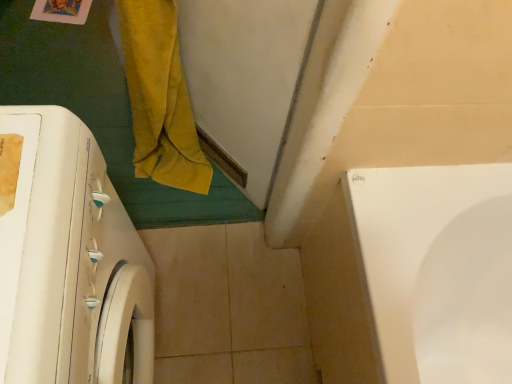
Identify the location of white glossy washing machine at left. (67, 258).

This screenshot has height=384, width=512. What do you see at coordinates (67, 258) in the screenshot?
I see `white glossy washing machine at left` at bounding box center [67, 258].

From the picture: Measure the distance between point (127, 8) and camera.

Point (127, 8) and camera are 32.80 inches apart.

Describe the element at coordinates (160, 97) in the screenshot. I see `yellow velvety bath towel at left` at that location.

Where is `yellow velvety bath towel at left`? yellow velvety bath towel at left is located at coordinates (160, 97).

This screenshot has width=512, height=384. Find the location of `white glossy washing machine at left`. white glossy washing machine at left is located at coordinates (67, 258).

Consider the image. Between yellow velvety bath towel at left and white glossy washing machine at left, which one appears on the left side from the viewer's perspective?

From the viewer's perspective, white glossy washing machine at left appears more on the left side.

Which object is closer to the camera, yellow velvety bath towel at left or white glossy washing machine at left?

white glossy washing machine at left is in front.

Considering the positions of points (129, 82) and (11, 219), is point (129, 82) closer to camera compared to point (11, 219)?

No, (129, 82) is behind (11, 219).

From the image's perspective, who appears lower, yellow velvety bath towel at left or white glossy washing machine at left?

white glossy washing machine at left is shown below in the image.

From a real-world perspective, between yellow velvety bath towel at left and white glossy washing machine at left, who is vertically lower?

yellow velvety bath towel at left is physically lower.

In terms of width, does yellow velvety bath towel at left look wider or thinner when compared to white glossy washing machine at left?

Considering their sizes, yellow velvety bath towel at left looks slimmer than white glossy washing machine at left.

Considering the sizes of objects yellow velvety bath towel at left and white glossy washing machine at left in the image provided, who is taller, yellow velvety bath towel at left or white glossy washing machine at left?

With more height is white glossy washing machine at left.

Does yellow velvety bath towel at left have a larger size compared to white glossy washing machine at left?

No.

Would you say white glossy washing machine at left is part of yellow velvety bath towel at left's contents?

No, white glossy washing machine at left is not surrounded by yellow velvety bath towel at left.

Are yellow velvety bath towel at left and white glossy washing machine at left far apart?

No, yellow velvety bath towel at left is not far from white glossy washing machine at left.

Is white glossy washing machine at left at the back of yellow velvety bath towel at left?

No, white glossy washing machine at left is not at the back of yellow velvety bath towel at left.

The width and height of the screenshot is (512, 384). I want to click on bath towel above the white glossy washing machine at left (from the image's perspective), so click(160, 97).

In the scene shown: Between white glossy washing machine at left and yellow velvety bath towel at left, which one appears on the right side from the viewer's perspective?

yellow velvety bath towel at left is more to the right.

Which is in front, white glossy washing machine at left or yellow velvety bath towel at left?

white glossy washing machine at left is closer to the camera.

Which is behind, point (141, 301) or point (191, 168)?

The point (191, 168) is more distant.

From the image's perspective, is white glossy washing machine at left above or below yellow velvety bath towel at left?

Based on their image positions, white glossy washing machine at left is located beneath yellow velvety bath towel at left.

From a real-world perspective, is white glossy washing machine at left physically located above or below yellow velvety bath towel at left?

In terms of real-world spatial position, white glossy washing machine at left is above yellow velvety bath towel at left.

Does white glossy washing machine at left have a lesser width compared to yellow velvety bath towel at left?

Incorrect, the width of white glossy washing machine at left is not less than that of yellow velvety bath towel at left.

Who is taller, white glossy washing machine at left or yellow velvety bath towel at left?

With more height is white glossy washing machine at left.

Is white glossy washing machine at left smaller than yellow velvety bath towel at left?

No.

Would you say white glossy washing machine at left contains yellow velvety bath towel at left?

No, yellow velvety bath towel at left is not surrounded by white glossy washing machine at left.

Does white glossy washing machine at left touch yellow velvety bath towel at left?

white glossy washing machine at left and yellow velvety bath towel at left are not in contact.

Is white glossy washing machine at left facing towards yellow velvety bath towel at left?

No, white glossy washing machine at left is not facing towards yellow velvety bath towel at left.

What's the angular difference between white glossy washing machine at left and yellow velvety bath towel at left's facing directions?

The angle between the facing direction of white glossy washing machine at left and the facing direction of yellow velvety bath towel at left is 139 degrees.

I want to click on bath towel located on the right of white glossy washing machine at left, so click(160, 97).

Find the location of `washing machine on the left of the yellow velvety bath towel at left`. washing machine on the left of the yellow velvety bath towel at left is located at coordinates (67, 258).

At what (x,y) coordinates should I click in order to perform the action: click on bath towel that is behind the white glossy washing machine at left. Please return your answer as a coordinate pair (x, y). Looking at the image, I should click on (160, 97).